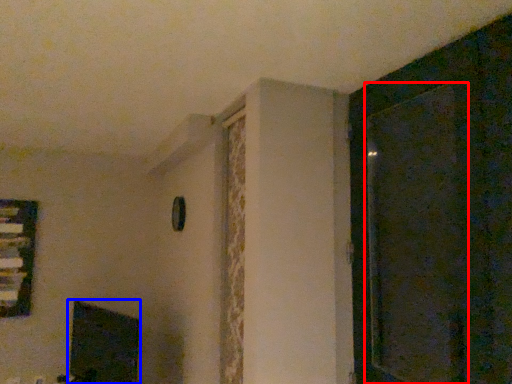
Question: Which object is closer to the camera taking this photo, screen door (highlighted by a red box) or fireplace (highlighted by a blue box)?

Choices:
 (A) screen door
 (B) fireplace

Answer: (A)